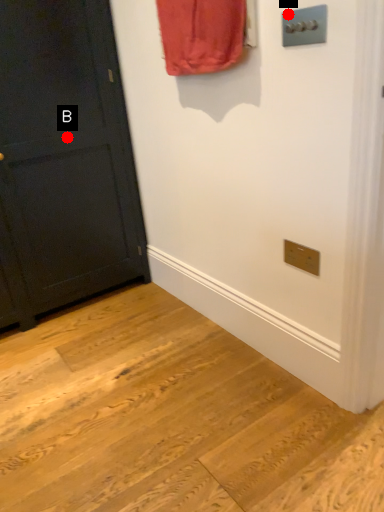
Question: Two points are circled on the image, labeled by A and B beside each circle. Which point is farther to the camera?

Choices:
 (A) A is further
 (B) B is further

Answer: (B)